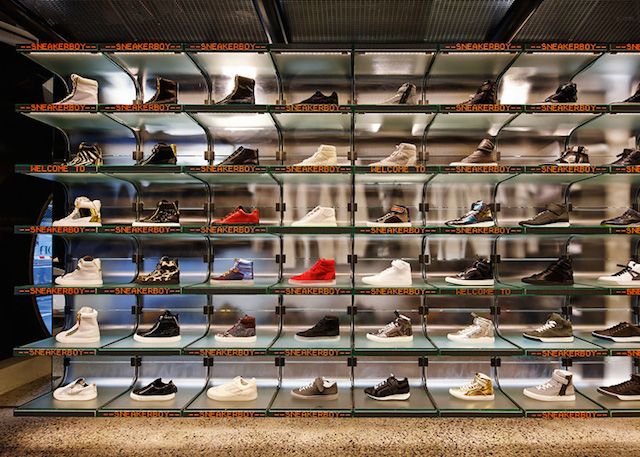
The width and height of the screenshot is (640, 457). I want to click on sneakers on 4th shelve, so click(x=90, y=210), click(x=160, y=218), click(x=244, y=217), click(x=321, y=212), click(x=400, y=215), click(x=473, y=211), click(x=555, y=215), click(x=619, y=217).